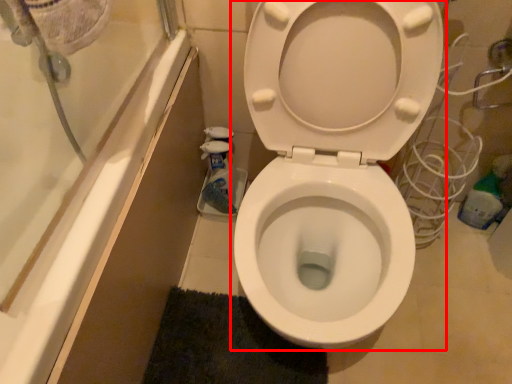
Question: In this image, where is toilet (annotated by the red box) located relative to bath mat?

Choices:
 (A) left
 (B) right

Answer: (B)